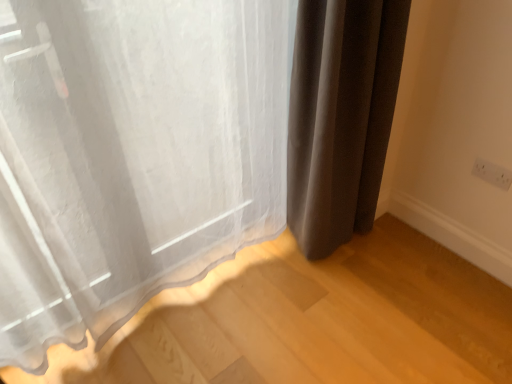
You are a GUI agent. You are given a task and a screenshot of the screen. Output one action in this format:
    pyautogui.click(x=<x>, y=<y>)
    Task: Click on the spots to the right of dark velvet curtain at right
    
    Given the screenshot: What is the action you would take?
    pyautogui.click(x=406, y=248)